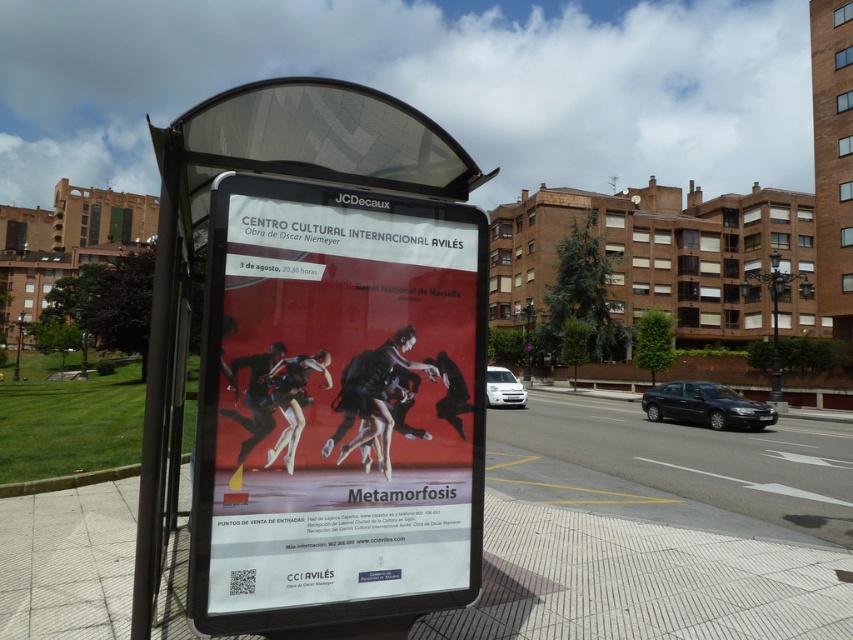
Can you confirm if matte paper poster at center is smaller than smooth concrete pavement at center?

Yes.

Is the position of matte paper poster at center more distant than that of smooth concrete pavement at center?

No, matte paper poster at center is in front of smooth concrete pavement at center.

Which is in front, point (421, 516) or point (38, 632)?

Point (421, 516)

At what (x,y) coordinates should I click in order to perform the action: click on matte paper poster at center. Please return your answer as a coordinate pair (x, y). The image size is (853, 640). Looking at the image, I should click on (341, 400).